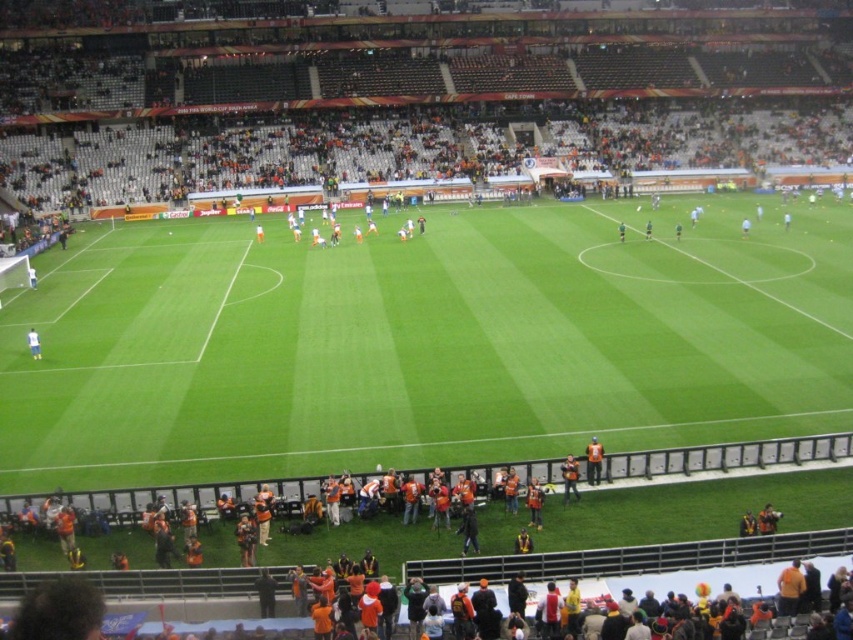
Is green grass football field at center further to the viewer compared to orange fabric jacket at lower center?

No.

Does point (563, 237) lie in front of point (577, 476)?

No.

The height and width of the screenshot is (640, 853). I want to click on green grass football field at center, so click(x=425, y=342).

The height and width of the screenshot is (640, 853). I want to click on green grass football field at center, so click(425, 342).

Does point (48, 333) come closer to viewer compared to point (595, 474)?

No, it is behind (595, 474).

Image resolution: width=853 pixels, height=640 pixels. Describe the element at coordinates (425, 342) in the screenshot. I see `green grass football field at center` at that location.

At what (x,y) coordinates should I click in order to perform the action: click on green grass football field at center. Please return your answer as a coordinate pair (x, y). Looking at the image, I should click on (425, 342).

Does green grass football field at center have a greater width compared to white matte shirt at lower left?

Yes.

Who is taller, green grass football field at center or white matte shirt at lower left?

green grass football field at center is taller.

The image size is (853, 640). I want to click on green grass football field at center, so click(425, 342).